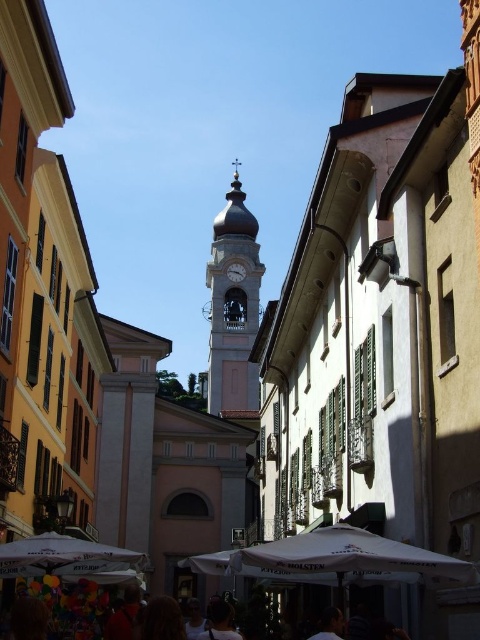
Question: Which of the following is the farthest from the observer?

Choices:
 (A) white marble bell tower at center
 (B) dark brown hair at center
 (C) white fabric umbrella at lower center

Answer: (A)

Question: Estimate the real-world distances between objects in this image. Which object is closer to the dark brown hair at center?

Choices:
 (A) metallic gray clock at center
 (B) dark brown hair at lower center
 (C) red shirt at lower center

Answer: (B)

Question: Is white marble bell tower at center thinner than red shirt at lower center?

Choices:
 (A) no
 (B) yes

Answer: (A)

Question: Does white fabric umbrella at lower center have a larger size compared to red shirt at lower center?

Choices:
 (A) no
 (B) yes

Answer: (B)

Question: Which object appears closest to the camera in this image?

Choices:
 (A) red shirt at lower center
 (B) white fabric umbrella at lower left
 (C) white fabric umbrella at lower center

Answer: (C)

Question: Can you confirm if white marble bell tower at center is thinner than white fabric umbrella at lower left?

Choices:
 (A) no
 (B) yes

Answer: (A)